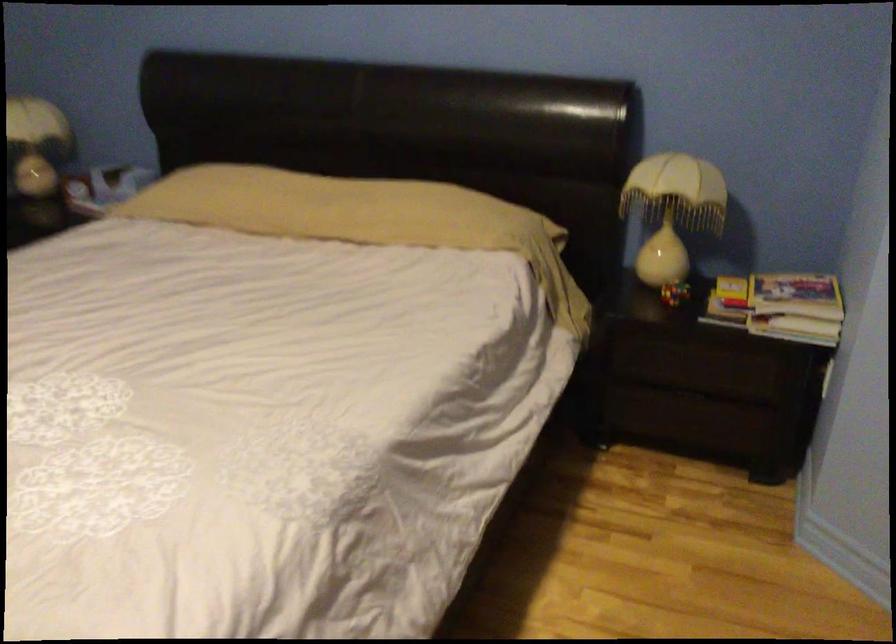
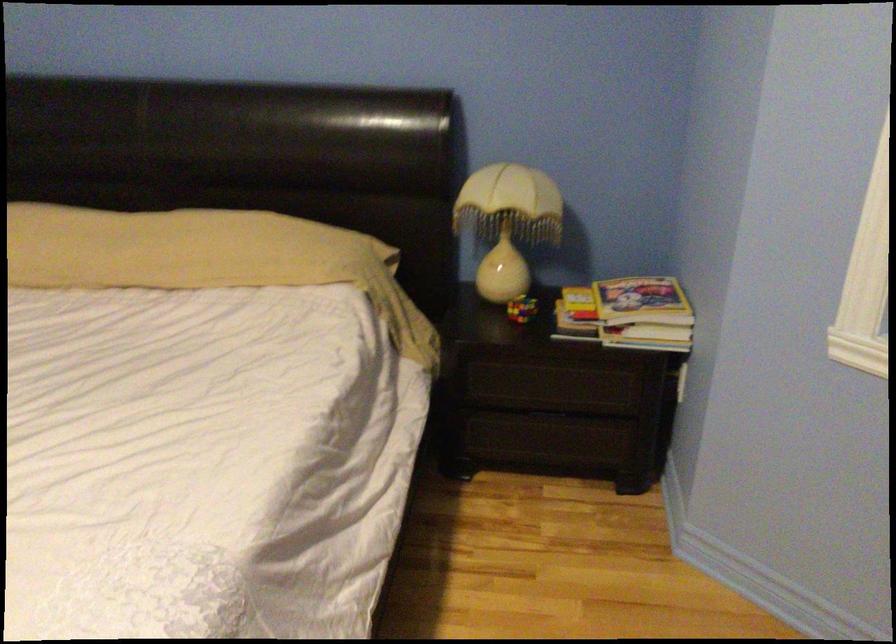
In the second image, find the point that corresponds to [676,290] in the first image.

(521, 308)